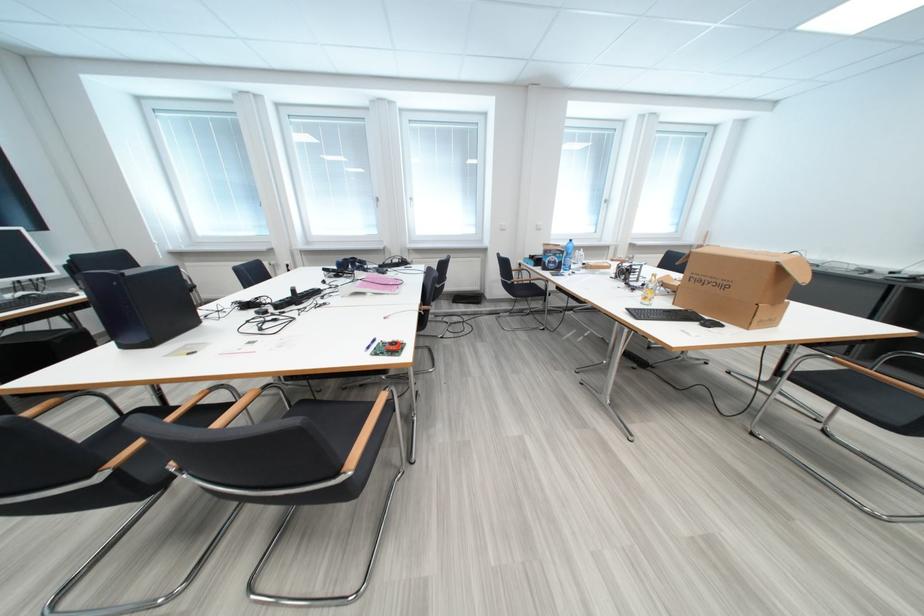
This screenshot has width=924, height=616. What do you see at coordinates (739, 284) in the screenshot? I see `a open cardboard box` at bounding box center [739, 284].